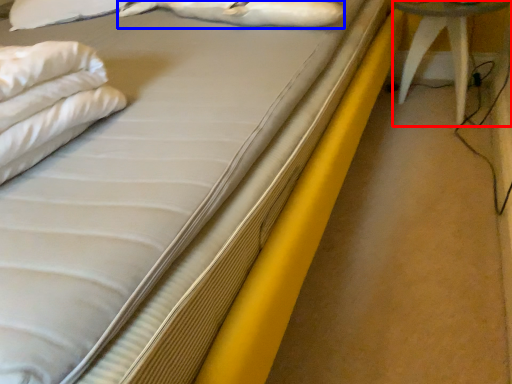
Question: Which of the following is the farthest to the observer, furniture (highlighted by a red box) or animal (highlighted by a blue box)?

Choices:
 (A) furniture
 (B) animal

Answer: (A)